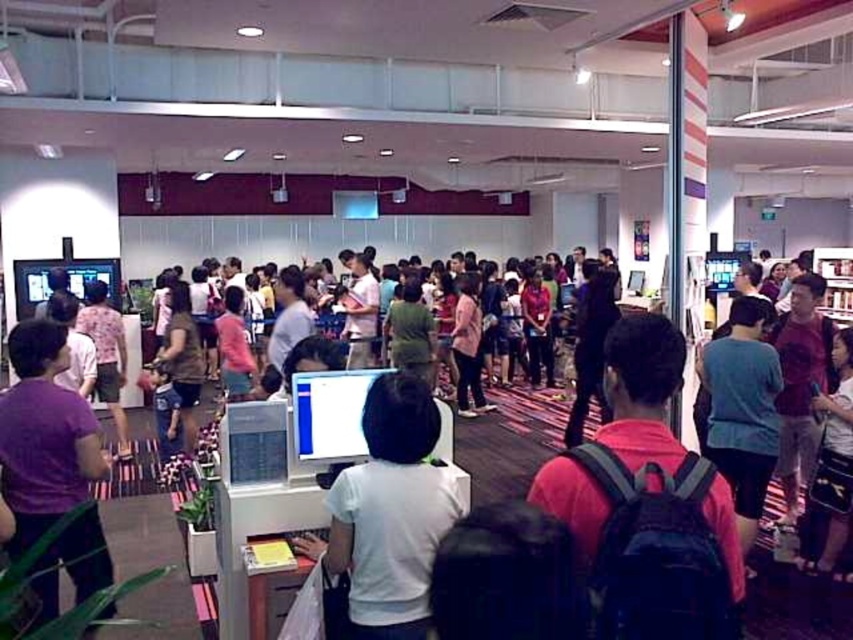
You are a person with a 1.8 meter reach. You are standing at the white cotton shirt at center and want to reach the white matte computer at center. Can you reach it?

The distance between the white matte computer at center and the white cotton shirt at center is 3.05 meters. Since your reach is only 1.8 meters, you cannot reach the white matte computer at center from the white cotton shirt at center.

You are a visitor at this event and want to place your red backpack at center on the white matte computer at center. Is this possible based on their positions?

The red backpack at center is located above the white matte computer at center, so placing the red backpack at center on the white matte computer at center would not be possible since it is already positioned above it.